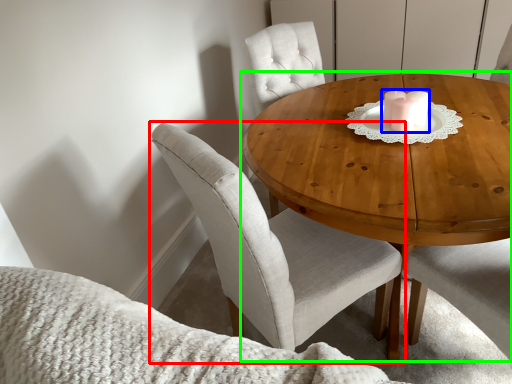
Question: Which object is the closest to the chair (highlighted by a red box)? Choose among these: candle holder (highlighted by a blue box) or coffee table (highlighted by a green box).

Choices:
 (A) candle holder
 (B) coffee table

Answer: (B)